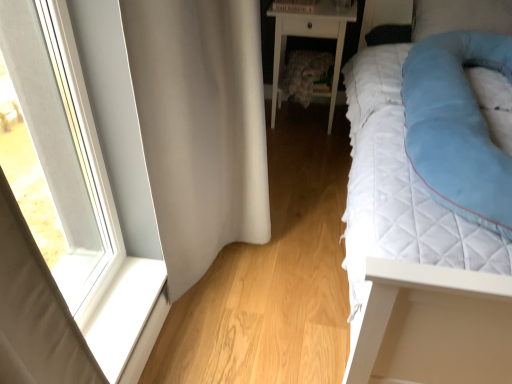
Identify the location of vacant area that is situated to the right of white fabric curtain at left. (311, 220).